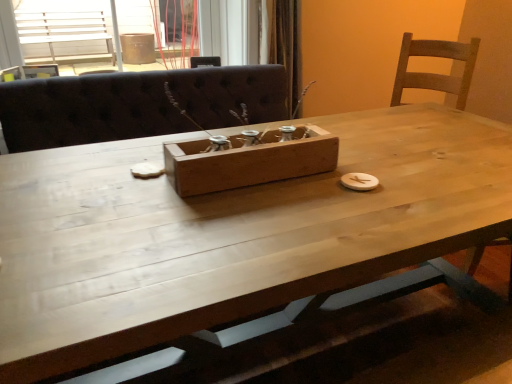
Image resolution: width=512 pixels, height=384 pixels. What are the coordinates of `vacant area on top of natural wood table at center (from a real-world perspective)` in the screenshot? It's located at (288, 190).